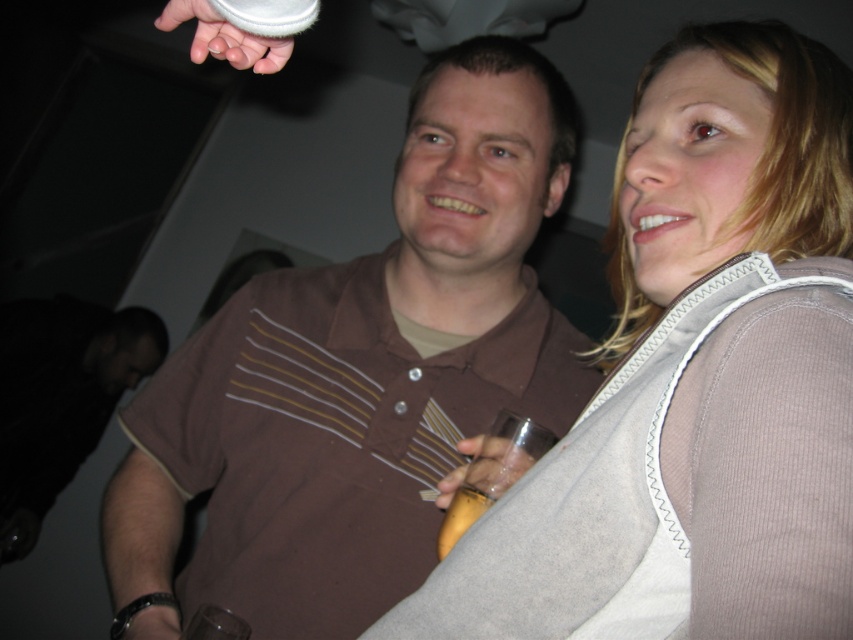
Between translucent glass at right and white fabric at upper left, which one has more height?

white fabric at upper left is taller.

Is point (496, 467) farther from camera compared to point (204, 8)?

Yes, point (496, 467) is behind point (204, 8).

Identify the location of translucent glass at right. (492, 472).

Can you confirm if brown striped shirt at center is thinner than yellow plastic cup at center?

No, brown striped shirt at center is not thinner than yellow plastic cup at center.

Who is lower down, brown striped shirt at center or yellow plastic cup at center?

yellow plastic cup at center is lower down.

Between point (421, 547) and point (466, 486), which one is positioned behind?

Positioned behind is point (421, 547).

Where is `brown striped shirt at center`? The image size is (853, 640). brown striped shirt at center is located at coordinates (358, 378).

Is the position of brown striped shirt at center less distant than that of white fabric at upper left?

That is False.

Locate an element on the screen. The width and height of the screenshot is (853, 640). brown striped shirt at center is located at coordinates (358, 378).

Is point (509, 262) in front of point (173, 20)?

No.

I want to click on brown striped shirt at center, so click(x=358, y=378).